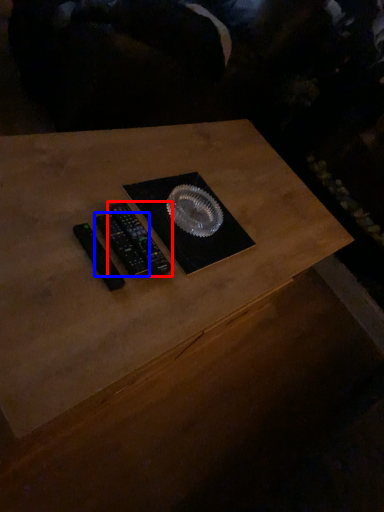
Question: Which point is further to the camera, control (highlighted by a red box) or control (highlighted by a blue box)?

Choices:
 (A) control
 (B) control

Answer: (A)